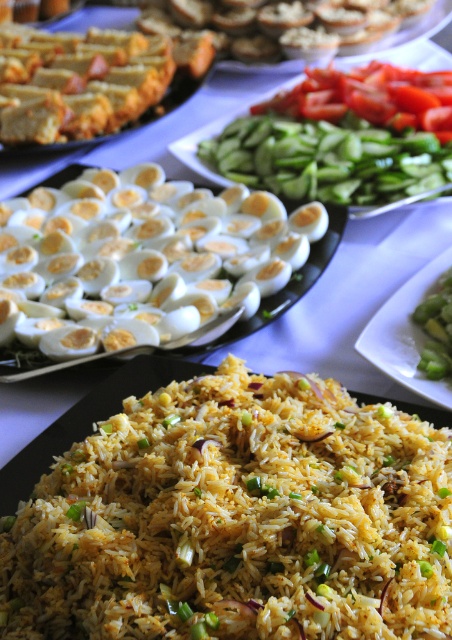
Question: Which point appears farthest from the camera in this image?

Choices:
 (A) (18, 280)
 (B) (290, 196)
 (C) (278, 100)

Answer: (C)

Question: Based on their relative distances, which object is nearer to the crusty bread at upper center?

Choices:
 (A) green smooth beans at upper center
 (B) white hard-boiled eggs at center
 (C) green smoothsmoothvegetable at right
 (D) golden-brown bread at upper left

Answer: (D)

Question: Can you confirm if crusty bread at upper center is positioned to the right of green smooth beans at upper center?

Choices:
 (A) yes
 (B) no

Answer: (B)

Question: Is green smooth beans at upper center positioned at the back of green smoothsmoothvegetable at right?

Choices:
 (A) yes
 (B) no

Answer: (A)

Question: Is yellow fried rice at center wider than golden-brown bread at upper left?

Choices:
 (A) yes
 (B) no

Answer: (B)

Question: Which point is closer to the camera?

Choices:
 (A) (410, 291)
 (B) (183, 268)

Answer: (A)